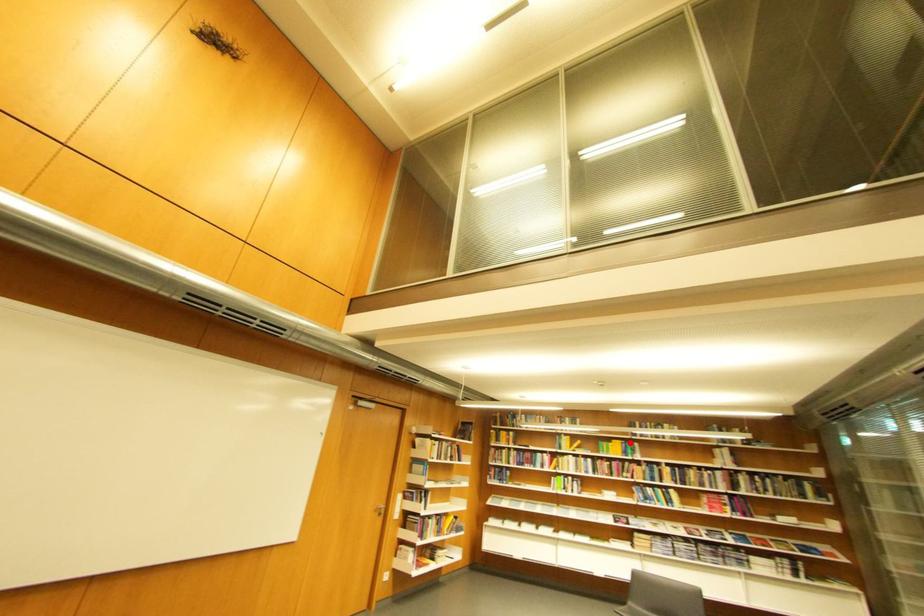
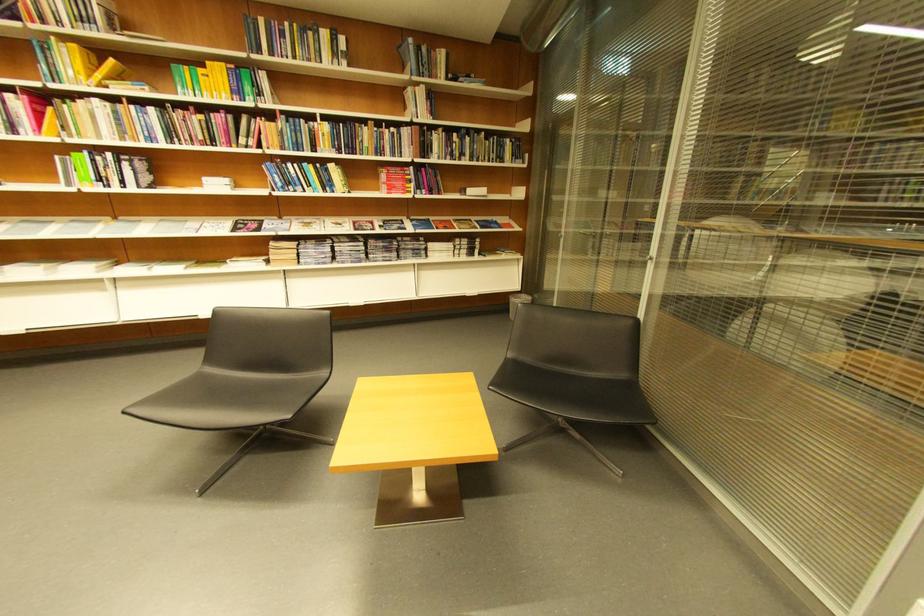
The point at the highlighted location is marked in the first image. Where is the corresponding point in the second image?

(234, 66)